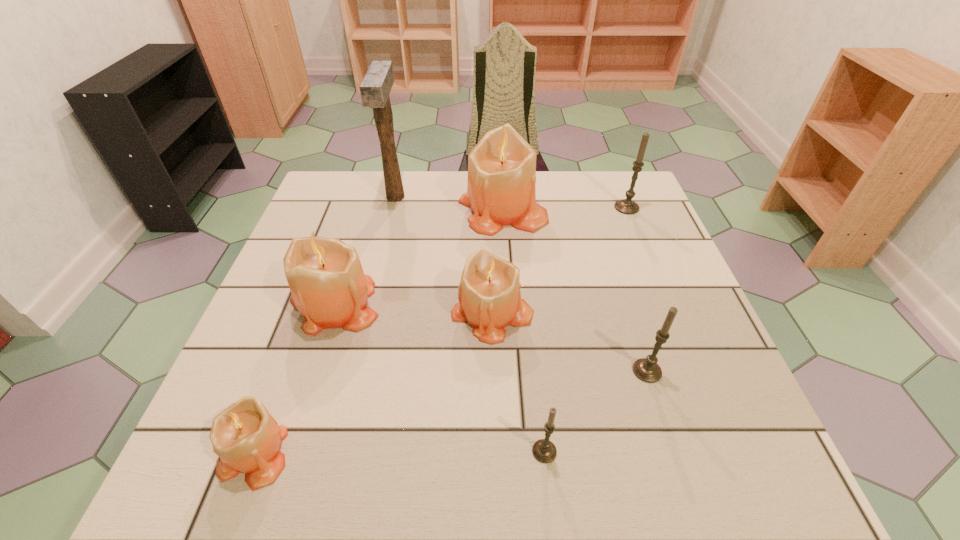
I want to click on vacant point located between the smallest beige candle and the third biggest beige candle, so click(x=374, y=384).

Find the location of a particular element. free space between the second smallest beige candle and the farthest gray candle is located at coordinates (560, 261).

Where is `free space between the second biggest gray candle and the rightmost candle`? Image resolution: width=960 pixels, height=540 pixels. free space between the second biggest gray candle and the rightmost candle is located at coordinates (636, 289).

You are a GUI agent. You are given a task and a screenshot of the screen. Output one action in this format:
    pyautogui.click(x=<x>, y=<y>)
    Task: Click on the empty space that is in between the nearest beige candle and the smallest gray candle
    
    Given the screenshot: What is the action you would take?
    pyautogui.click(x=400, y=453)

Locate an element on the screen. free space between the sixth farthest object and the mallet is located at coordinates (521, 284).

Select which object appears as the seventh closest to the rightmost object. Please provide its 2D coordinates. Your answer should be formatted as a tuple, i.e. [(x, y)], where the tuple contains the x and y coordinates of a point satisfying the conditions above.

[(246, 437)]

The width and height of the screenshot is (960, 540). In order to click on object that is the fifth nearest to the nearest beige candle in this screenshot , I will do `click(375, 88)`.

The image size is (960, 540). I want to click on candle object that ranks as the sixth closest to the biggest beige candle, so click(246, 437).

Choose which candle is the fourth nearest neighbor to the third biggest beige candle. Please provide its 2D coordinates. Your answer should be formatted as a tuple, i.e. [(x, y)], where the tuple contains the x and y coordinates of a point satisfying the conditions above.

[(543, 450)]

Locate an element on the screen. Image resolution: width=960 pixels, height=540 pixels. beige candle object that ranks as the second closest to the tallest object is located at coordinates (329, 288).